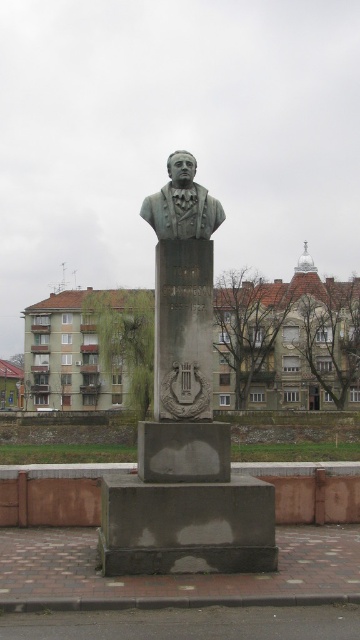
Question: Is green polished bust at center further to the viewer compared to green patina bust at center?

Choices:
 (A) yes
 (B) no

Answer: (B)

Question: Does green polished bust at center have a greater width compared to green patina bust at center?

Choices:
 (A) no
 (B) yes

Answer: (B)

Question: Which object is farther from the camera taking this photo?

Choices:
 (A) green patina bust at center
 (B) green polished bust at center

Answer: (A)

Question: Does green polished bust at center appear over green patina bust at center?

Choices:
 (A) no
 (B) yes

Answer: (A)

Question: Which point appears farthest from the camera in this image?

Choices:
 (A) (145, 209)
 (B) (160, 474)

Answer: (A)